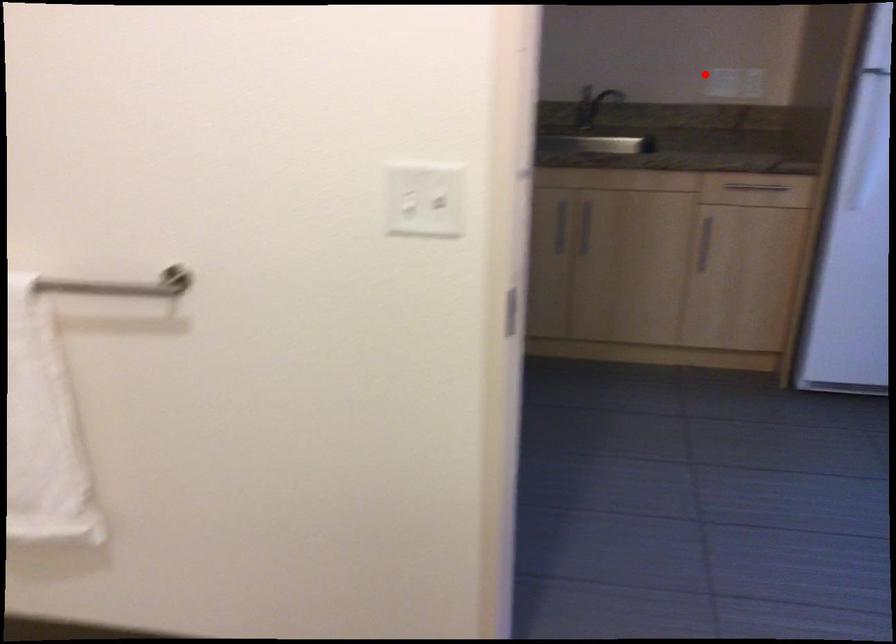
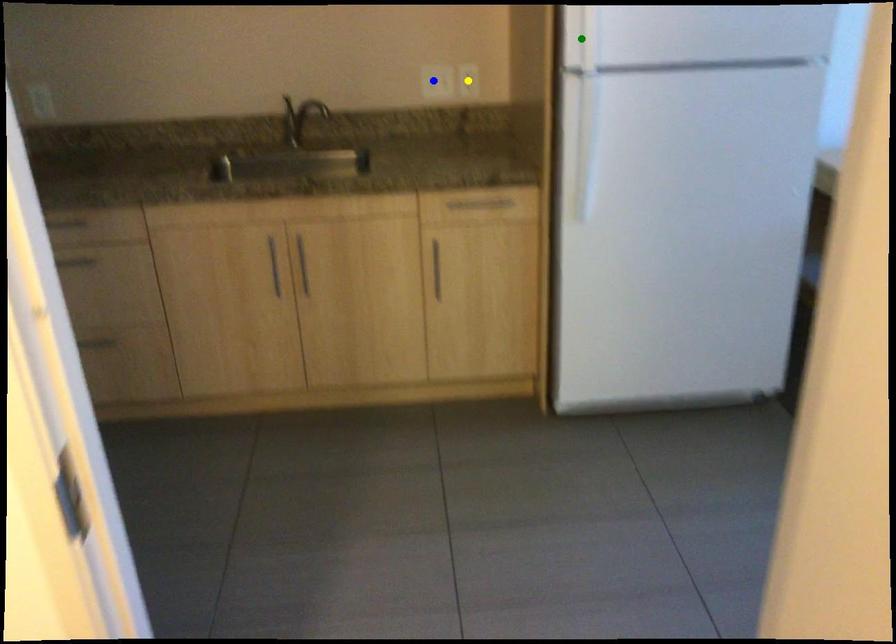
Question: I am providing you with two images of the same scene from different viewpoints. A red point is marked on the first image. You are given multiple points on the second image. Which point in image 2 represents the same 3d spot as the red point in image 1?

Choices:
 (A) blue point
 (B) yellow point
 (C) green point

Answer: (A)